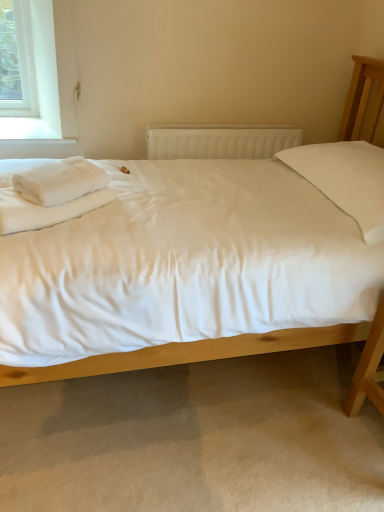
Question: Does point (38, 204) appear closer or farther from the camera than point (168, 144)?

Choices:
 (A) closer
 (B) farther

Answer: (A)

Question: From the image's perspective, is white soft bedsheet at left positioned above or below white plastic radiator at center?

Choices:
 (A) below
 (B) above

Answer: (A)

Question: Which object is the closest to the white fluffy towel at left?

Choices:
 (A) white cotton bed at center
 (B) white soft bedsheet at left
 (C) white plastic radiator at center

Answer: (B)

Question: Estimate the real-world distances between objects in this image. Which object is farther from the white soft bedsheet at left?

Choices:
 (A) white fluffy towel at left
 (B) white cotton bed at center
 (C) white plastic radiator at center

Answer: (C)